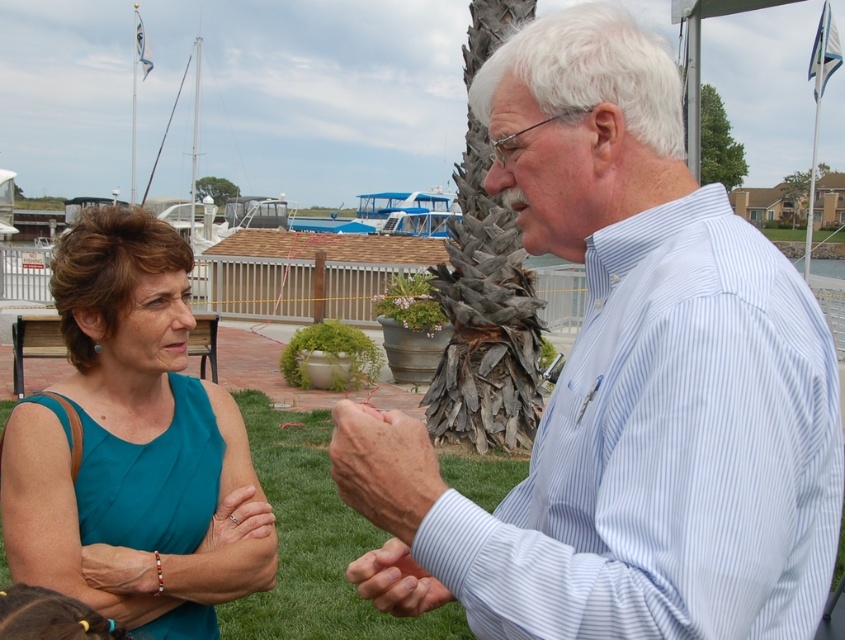
Does teal fabric dress at left have a lesser height compared to gray textured palm tree at center?

Correct, teal fabric dress at left is not as tall as gray textured palm tree at center.

Find the location of `teal fabric dress at left`. teal fabric dress at left is located at coordinates coord(134,448).

In the scene shown: Is gray textured palm tree at center taller than smooth skin hand at center?

Yes, gray textured palm tree at center is taller than smooth skin hand at center.

Based on the photo, is gray textured palm tree at center positioned before smooth skin hand at center?

No.

Identify the location of gray textured palm tree at center. The image size is (845, 640). tap(484, 320).

Is dry skin at center to the right of smooth skin hand at center from the viewer's perspective?

In fact, dry skin at center is to the left of smooth skin hand at center.

Which is behind, point (418, 454) or point (435, 579)?

The point (435, 579) is more distant.

Locate an element on the screen. The width and height of the screenshot is (845, 640). dry skin at center is located at coordinates (383, 467).